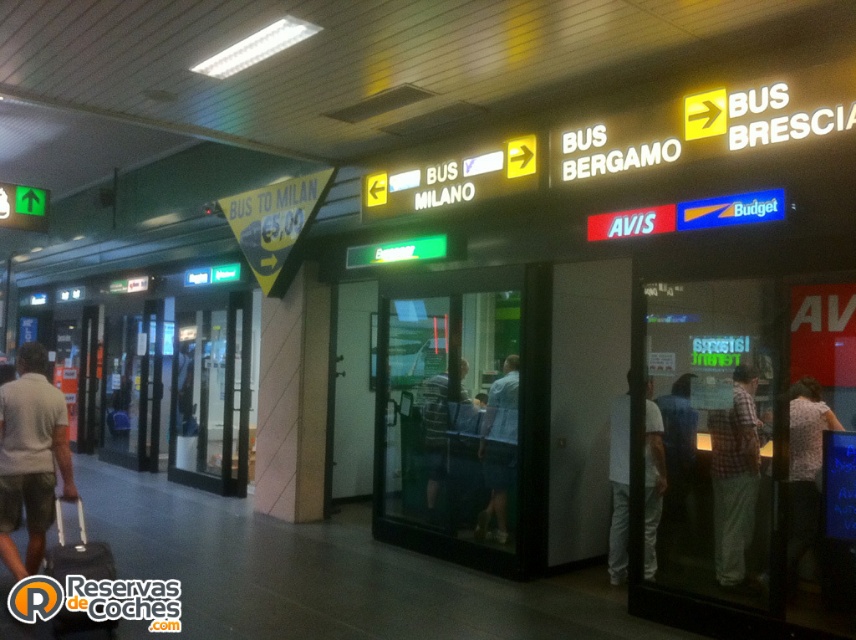
Question: Which point is closer to the camera taking this photo?

Choices:
 (A) (717, 573)
 (B) (501, 392)
 (C) (58, 520)
 (D) (440, 413)

Answer: (C)

Question: Which point is farther to the camera?

Choices:
 (A) white shirt at right
 (B) gray cotton shirt at lower left
 (C) white matte shirt at center
 (D) black fabric suitcase at lower left

Answer: (C)

Question: Does gray cotton shirt at lower left lie in front of light blue shirt at center?

Choices:
 (A) yes
 (B) no

Answer: (A)

Question: Does white matte shirt at center appear under white shirt at right?

Choices:
 (A) no
 (B) yes

Answer: (B)

Question: Which object is closer to the camera taking this photo?

Choices:
 (A) striped shirt at center
 (B) plaid shirt at center
 (C) black fabric suitcase at lower left
 (D) white shirt at right

Answer: (C)

Question: Does white shirt at right appear on the right side of black fabric suitcase at lower left?

Choices:
 (A) yes
 (B) no

Answer: (A)